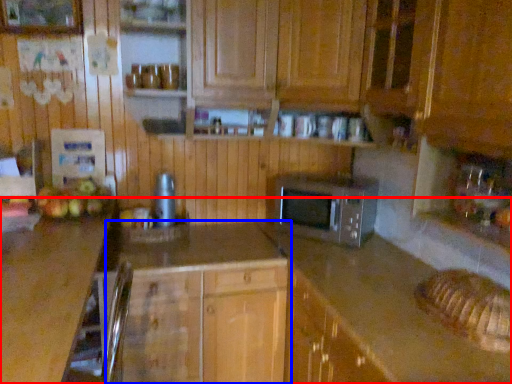
Question: Which object is closer to the camera taking this photo, countertop (highlighted by a red box) or cabinetry (highlighted by a blue box)?

Choices:
 (A) countertop
 (B) cabinetry

Answer: (A)